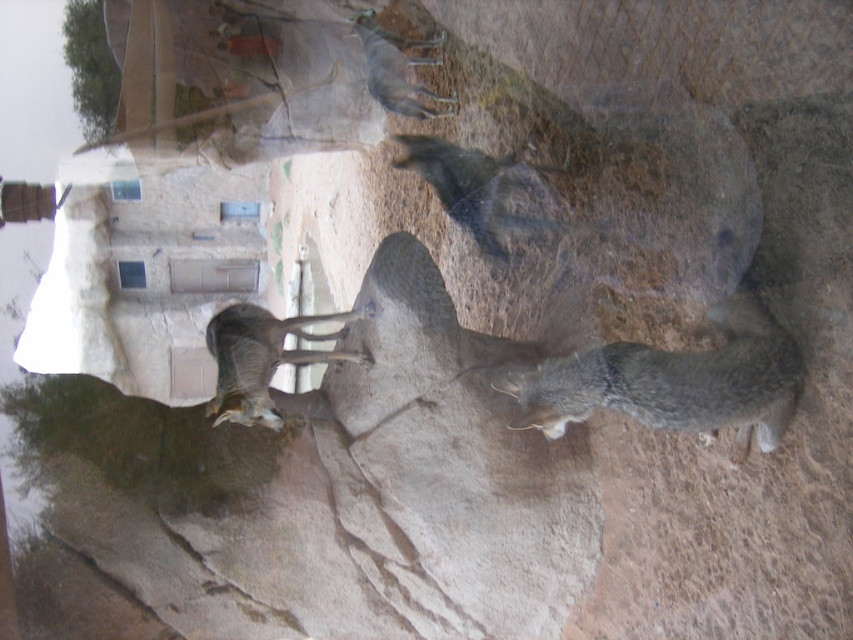
Is gray fur cat at lower right positioned at the back of gray fur goat at upper center?

No, it is in front of gray fur goat at upper center.

Who is shorter, gray fur cat at lower right or gray fur goat at upper center?

gray fur cat at lower right

The image size is (853, 640). In order to click on gray fur cat at lower right in this screenshot , I will do `click(674, 381)`.

The image size is (853, 640). Find the location of `gray fur cat at lower right`. gray fur cat at lower right is located at coordinates (674, 381).

Who is more distant from viewer, [279,358] or [399,38]?

The point [399,38] is more distant.

This screenshot has width=853, height=640. I want to click on gray fur antelope at center, so click(263, 358).

Does gray fur cat at lower right appear on the left side of gray fur antelope at center?

In fact, gray fur cat at lower right is to the right of gray fur antelope at center.

Can you confirm if gray fur cat at lower right is positioned to the right of gray fur antelope at center?

Yes, gray fur cat at lower right is to the right of gray fur antelope at center.

The height and width of the screenshot is (640, 853). I want to click on gray fur cat at lower right, so click(x=674, y=381).